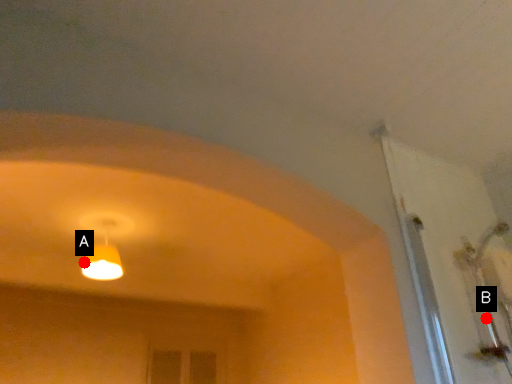
Question: Two points are circled on the image, labeled by A and B beside each circle. Which point is closer to the camera?

Choices:
 (A) A is closer
 (B) B is closer

Answer: (B)